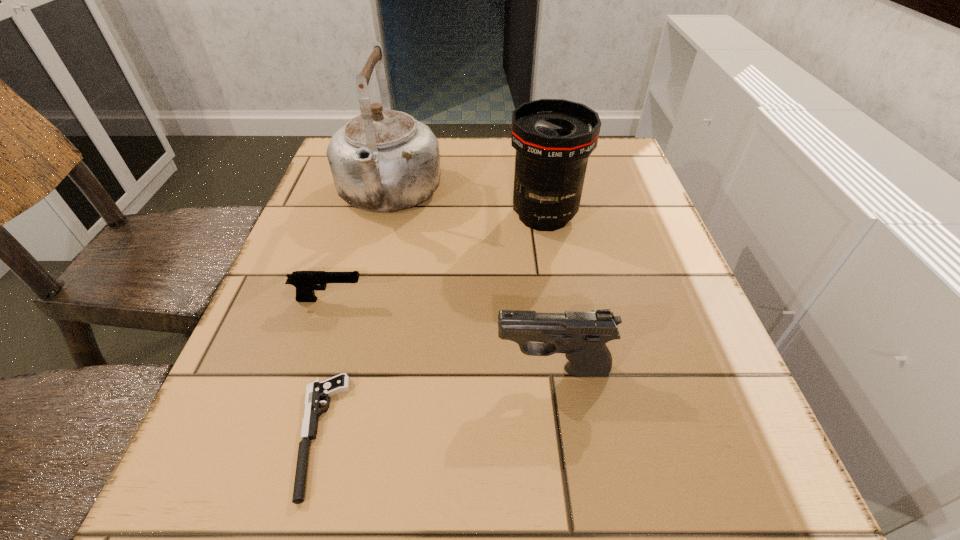
In order to click on vacant position located 0.330m at the barrel of the rightmost pistol in this screenshot , I will do (284, 370).

The height and width of the screenshot is (540, 960). Identify the location of free space located 0.280m at the barrel of the rightmost pistol. (316, 370).

At what (x,y) coordinates should I click in order to perform the action: click on free region located 0.230m on the front-facing side of the third nearest object. Please return your answer as a coordinate pair (x, y). The image size is (960, 540). Looking at the image, I should click on (493, 300).

Find the location of `vacant region located 0.130m on the front-facing side of the shortest pistol`. vacant region located 0.130m on the front-facing side of the shortest pistol is located at coordinates (201, 435).

Identify the location of free spot located on the front-facing side of the shortest pistol. (252, 435).

The width and height of the screenshot is (960, 540). Find the location of `vacant area situated on the front-facing side of the shortest pistol`. vacant area situated on the front-facing side of the shortest pistol is located at coordinates (215, 435).

This screenshot has width=960, height=540. In order to click on object located at the far edge in this screenshot , I will do `click(383, 160)`.

At what (x,y) coordinates should I click in order to perform the action: click on object present at the near edge. Please return your answer as a coordinate pair (x, y). Looking at the image, I should click on (317, 390).

This screenshot has height=540, width=960. What are the coordinates of `kettle present at the left edge` in the screenshot? It's located at (383, 160).

Where is `object that is at the right edge`? The width and height of the screenshot is (960, 540). object that is at the right edge is located at coordinates (553, 138).